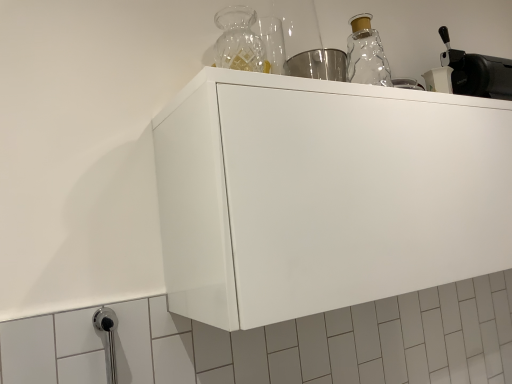
Question: Is white matte cabinet at center at the right side of black matte coffee machine at upper right?

Choices:
 (A) no
 (B) yes

Answer: (A)

Question: Is white matte cabinet at center in front of black matte coffee machine at upper right?

Choices:
 (A) yes
 (B) no

Answer: (A)

Question: From the image's perspective, does white matte cabinet at center appear higher than black matte coffee machine at upper right?

Choices:
 (A) yes
 (B) no

Answer: (B)

Question: Can you confirm if white matte cabinet at center is wider than black matte coffee machine at upper right?

Choices:
 (A) no
 (B) yes

Answer: (B)

Question: From a real-world perspective, is white matte cabinet at center positioned under black matte coffee machine at upper right based on gravity?

Choices:
 (A) yes
 (B) no

Answer: (A)

Question: Does white matte cabinet at center turn towards black matte coffee machine at upper right?

Choices:
 (A) yes
 (B) no

Answer: (B)

Question: Considering the relative sizes of black matte coffee machine at upper right and white matte cabinet at center in the image provided, is black matte coffee machine at upper right wider than white matte cabinet at center?

Choices:
 (A) yes
 (B) no

Answer: (B)

Question: From a real-world perspective, is black matte coffee machine at upper right below white matte cabinet at center?

Choices:
 (A) yes
 (B) no

Answer: (B)

Question: Is black matte coffee machine at upper right bigger than white matte cabinet at center?

Choices:
 (A) yes
 (B) no

Answer: (B)

Question: Is black matte coffee machine at upper right positioned in front of white matte cabinet at center?

Choices:
 (A) no
 (B) yes

Answer: (A)

Question: Is black matte coffee machine at upper right further to the viewer compared to white matte cabinet at center?

Choices:
 (A) no
 (B) yes

Answer: (B)

Question: Does black matte coffee machine at upper right have a lesser height compared to white matte cabinet at center?

Choices:
 (A) yes
 (B) no

Answer: (A)

Question: Is white matte cabinet at center wider or thinner than black matte coffee machine at upper right?

Choices:
 (A) wide
 (B) thin

Answer: (A)